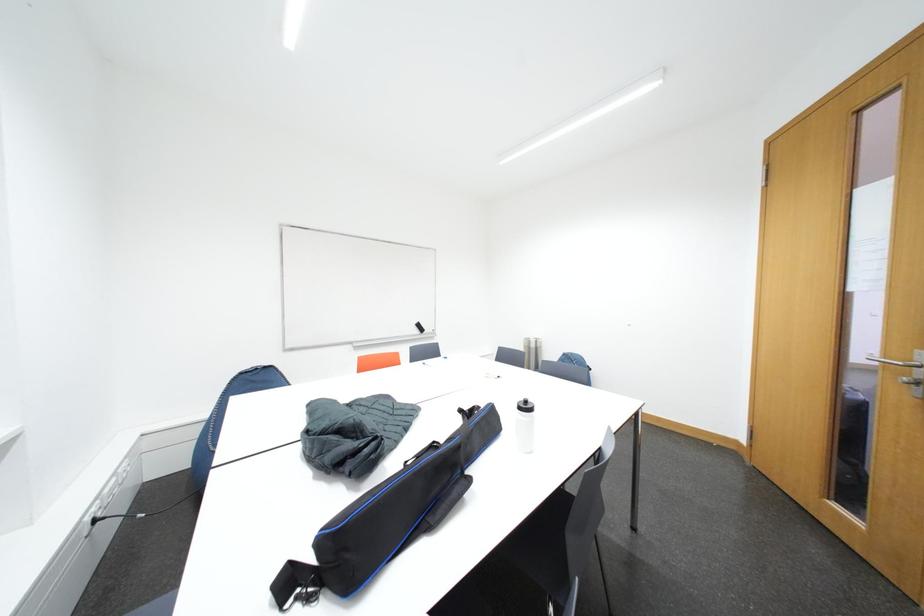
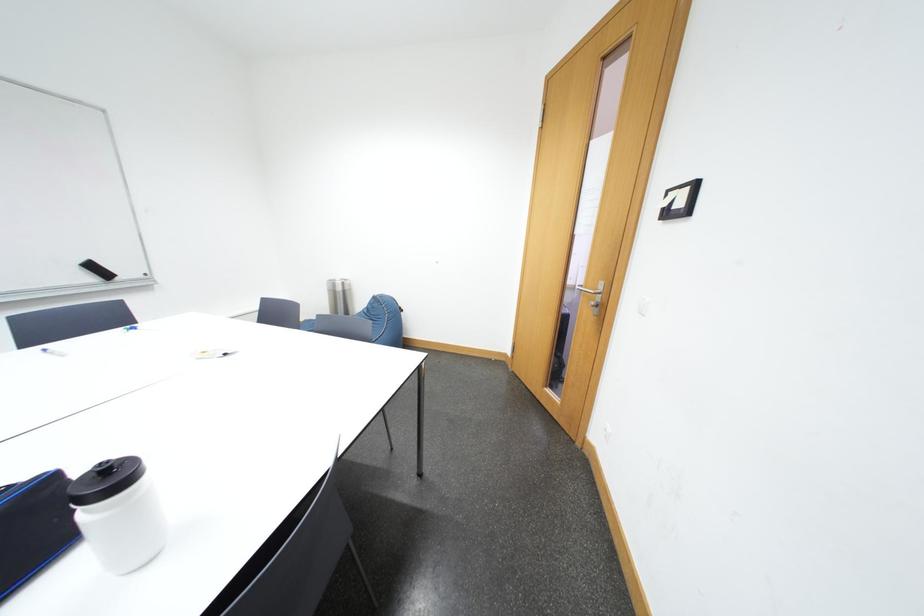
Question: The first image is from the beginning of the video and the second image is from the end. How did the camera likely rotate when shooting the video?

Choices:
 (A) Left
 (B) Right
 (C) Up
 (D) Down

Answer: (B)